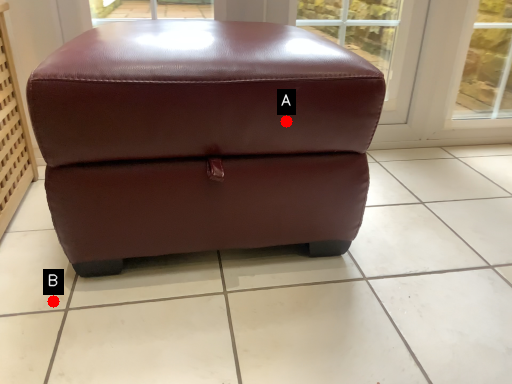
Question: Two points are circled on the image, labeled by A and B beside each circle. Which of the following is the closest to the observer?

Choices:
 (A) A is closer
 (B) B is closer

Answer: (A)